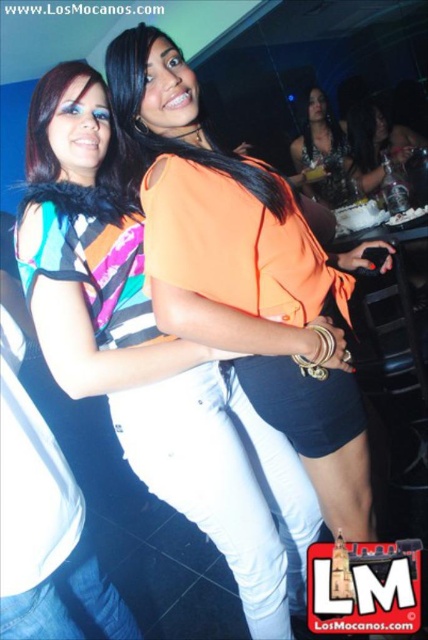
From the picture: You are a photographer standing at the back of the nightclub. You want to take a photo of both the matte orange shirt at center and the matte orange top at center. However, your camera has a maximum focus range of 2 meters. Can you capture both subjects in focus without moving closer?

The matte orange shirt at center is 2.02 meters from the matte orange top at center. Since the distance between them exceeds the camera maximum focus range of 2 meters, you cannot capture both subjects in focus without moving closer.

You are at a party and want to take a photo with the two women in the center. The photographer says you can stand either to the left or right of the group. If you want to be in the frame where the matte orange top at center is visible to your right and the satin black dress at center is visible to your left, which side should you choose?

You should stand to the left of the group because the matte orange top at center is to the right of the satin black dress at center. This positioning will allow you to see both items with the matte orange top at center on your right and the satin black dress at center on your left.

You are a photographer trying to capture a photo of the two outfits in the nightclub scene. The matte orange shirt at center and the satin black dress at center are both in focus. Which outfit appears taller in the photo?

The matte orange shirt at center appears taller than the satin black dress at center in the photo.